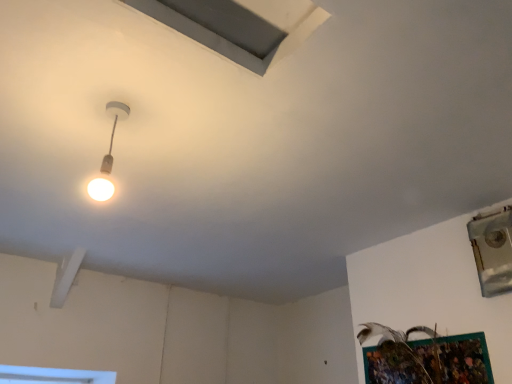
In order to face metallic silver window at upper right, should I rotate leftwards or rightwards?

You should rotate right by 29.626 degrees.

What do you see at coordinates (240, 26) in the screenshot? The height and width of the screenshot is (384, 512). I see `gray matte exhaust hood at upper center` at bounding box center [240, 26].

What is the approximate height of matte white lamp at upper left?

13.66 inches.

Find the location of `metallic silver window at upper right`. metallic silver window at upper right is located at coordinates point(493,250).

Between metallic silver window at upper right and gray matte exhaust hood at upper center, which one is positioned in front?

gray matte exhaust hood at upper center.

What's the angular difference between metallic silver window at upper right and gray matte exhaust hood at upper center's facing directions?

The angle between the facing direction of metallic silver window at upper right and the facing direction of gray matte exhaust hood at upper center is 90 degrees.

Considering the points (475, 222) and (265, 57), which point is behind, point (475, 222) or point (265, 57)?

The point (475, 222) is behind.

Where is `exhaust hood that is above the metallic silver window at upper right (from a real-world perspective)`? The height and width of the screenshot is (384, 512). exhaust hood that is above the metallic silver window at upper right (from a real-world perspective) is located at coordinates (240, 26).

Which is more to the left, gray matte exhaust hood at upper center or matte white lamp at upper left?

matte white lamp at upper left is more to the left.

Is gray matte exhaust hood at upper center next to matte white lamp at upper left?

There is a gap between gray matte exhaust hood at upper center and matte white lamp at upper left.

How distant is matte white lamp at upper left from gray matte exhaust hood at upper center?

A distance of 19.78 inches exists between matte white lamp at upper left and gray matte exhaust hood at upper center.

Looking at this image, is matte white lamp at upper left not within gray matte exhaust hood at upper center?

Indeed, matte white lamp at upper left is completely outside gray matte exhaust hood at upper center.

Between point (93, 185) and point (254, 35), which one is positioned in front?

Point (254, 35)

Can you confirm if matte white lamp at upper left is thinner than metallic silver window at upper right?

Correct, the width of matte white lamp at upper left is less than that of metallic silver window at upper right.

Measure the distance from matte white lamp at upper left to metallic silver window at upper right.

matte white lamp at upper left is 5.84 feet away from metallic silver window at upper right.

From a real-world perspective, is matte white lamp at upper left on metallic silver window at upper right?

Correct, in the physical world, matte white lamp at upper left is higher than metallic silver window at upper right.

Looking at this image, can you confirm if matte white lamp at upper left is shorter than metallic silver window at upper right?

Correct, matte white lamp at upper left is not as tall as metallic silver window at upper right.

Considering the positions of objects gray matte exhaust hood at upper center and metallic silver window at upper right in the image provided, who is in front, gray matte exhaust hood at upper center or metallic silver window at upper right?

Positioned in front is gray matte exhaust hood at upper center.

Does gray matte exhaust hood at upper center have a lesser width compared to metallic silver window at upper right?

Result: No, gray matte exhaust hood at upper center is not thinner than metallic silver window at upper right.

Considering the positions of objects gray matte exhaust hood at upper center and metallic silver window at upper right in the image provided, who is more to the right, gray matte exhaust hood at upper center or metallic silver window at upper right?

metallic silver window at upper right is more to the right.

The image size is (512, 384). I want to click on exhaust hood above the metallic silver window at upper right (from a real-world perspective), so click(240, 26).

Can you confirm if metallic silver window at upper right is smaller than matte white lamp at upper left?

Incorrect, metallic silver window at upper right is not smaller in size than matte white lamp at upper left.

Is metallic silver window at upper right aimed at matte white lamp at upper left?

Yes, metallic silver window at upper right faces towards matte white lamp at upper left.

Which is more to the left, metallic silver window at upper right or matte white lamp at upper left?

matte white lamp at upper left is more to the left.

In terms of height, does metallic silver window at upper right look taller or shorter compared to matte white lamp at upper left?

Clearly, metallic silver window at upper right is taller compared to matte white lamp at upper left.

The height and width of the screenshot is (384, 512). In order to click on exhaust hood in front of the metallic silver window at upper right in this screenshot , I will do `click(240, 26)`.

Where is `lamp located behind the gray matte exhaust hood at upper center`? The width and height of the screenshot is (512, 384). lamp located behind the gray matte exhaust hood at upper center is located at coordinates (113, 131).

Considering their positions, is matte white lamp at upper left positioned further to metallic silver window at upper right than gray matte exhaust hood at upper center?

Based on the image, matte white lamp at upper left appears to be further to metallic silver window at upper right.

Based on their spatial positions, is metallic silver window at upper right or matte white lamp at upper left closer to gray matte exhaust hood at upper center?

matte white lamp at upper left is positioned closer to the anchor gray matte exhaust hood at upper center.

Looking at the image, which one is located further to matte white lamp at upper left, metallic silver window at upper right or gray matte exhaust hood at upper center?

Among the two, metallic silver window at upper right is located further to matte white lamp at upper left.

Looking at the image, which one is located closer to gray matte exhaust hood at upper center, matte white lamp at upper left or metallic silver window at upper right?

matte white lamp at upper left is closer to gray matte exhaust hood at upper center.

From the image, which object appears to be farther from matte white lamp at upper left, gray matte exhaust hood at upper center or metallic silver window at upper right?

metallic silver window at upper right is further to matte white lamp at upper left.

When comparing their distances from metallic silver window at upper right, does gray matte exhaust hood at upper center or matte white lamp at upper left seem further?

Among the two, matte white lamp at upper left is located further to metallic silver window at upper right.

Locate an element on the screen. exhaust hood between matte white lamp at upper left and metallic silver window at upper right in the horizontal direction is located at coordinates (240, 26).